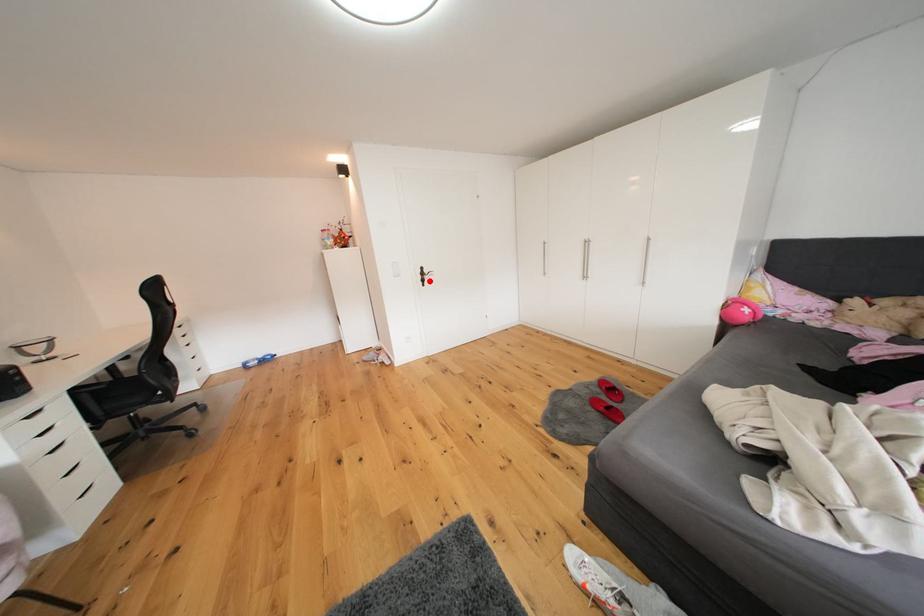
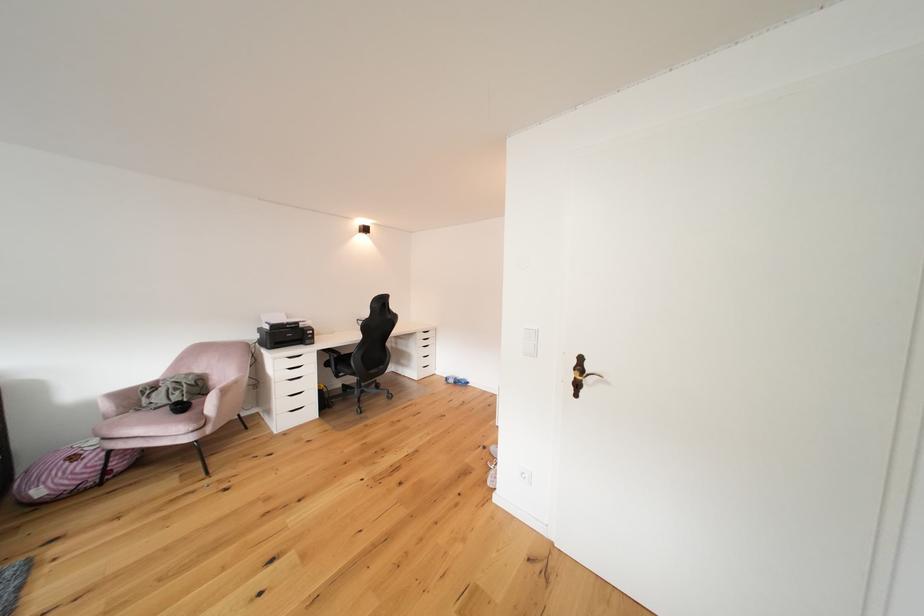
Find the pixel in the second image that matches the highlighted location in the first image.

(580, 379)